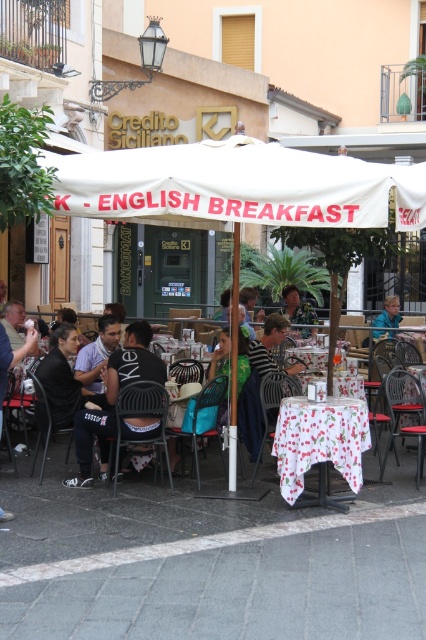
Question: Which point is farther from the camera taking this photo?

Choices:
 (A) (374, 333)
 (B) (72, 477)

Answer: (A)

Question: Which of these objects is positioned closest to the camouflage fabric shirt at center?

Choices:
 (A) white fabric canopy at center
 (B) blue denim jacket at center

Answer: (B)

Question: Which point is farther to the camera?

Choices:
 (A) (316, 320)
 (B) (104, 360)

Answer: (A)

Question: Is white floral tablecloth at center to the left of dark gray t-shirt at center from the viewer's perspective?

Choices:
 (A) yes
 (B) no

Answer: (B)

Question: Does white fabric canopy at center appear on the left side of dark gray t-shirt at center?

Choices:
 (A) no
 (B) yes

Answer: (A)

Question: Is dark gray t-shirt at center below blue denim jacket at center?

Choices:
 (A) no
 (B) yes

Answer: (B)